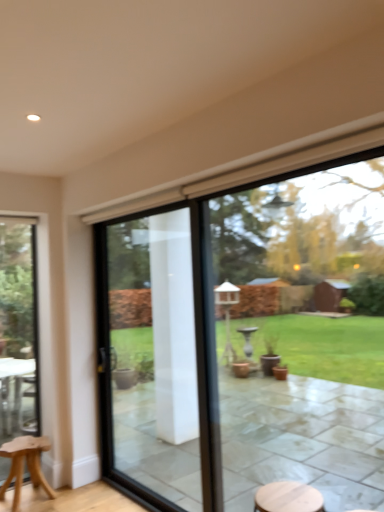
The width and height of the screenshot is (384, 512). I want to click on clear glass door at center, so click(x=160, y=359).

Considering the relative sizes of clear glass door at left, arranged as the 2th window when viewed from the front, and clear glass door at center in the image provided, is clear glass door at left, arranged as the 2th window when viewed from the front, shorter than clear glass door at center?

No.

In terms of width, does clear glass door at left, acting as the first window starting from the back, look wider or thinner when compared to clear glass door at center?

Considering their sizes, clear glass door at left, acting as the first window starting from the back, looks slimmer than clear glass door at center.

Between clear glass door at left, arranged as the 2th window when viewed from the front, and clear glass door at center, which one appears on the left side from the viewer's perspective?

From the viewer's perspective, clear glass door at left, arranged as the 2th window when viewed from the front, appears more on the left side.

Is clear glass door at left, the second window when ordered from right to left, directly adjacent to clear glass door at center?

No, clear glass door at left, the second window when ordered from right to left, is not in contact with clear glass door at center.

Can you confirm if clear glass door at center is taller than light brown wooden stool at lower left?

Indeed, clear glass door at center has a greater height compared to light brown wooden stool at lower left.

Between clear glass door at center and light brown wooden stool at lower left, which one appears on the left side from the viewer's perspective?

From the viewer's perspective, light brown wooden stool at lower left appears more on the left side.

Is clear glass door at center far away from light brown wooden stool at lower left?

That's right, there is a large distance between clear glass door at center and light brown wooden stool at lower left.

What's the angular difference between clear glass door at center and light brown wooden stool at lower left's facing directions?

There is a 0.547-degree angle between the facing directions of clear glass door at center and light brown wooden stool at lower left.

Is light brown wooden stool at lower left wider or thinner than clear glass door at left, acting as the first window starting from the back?

light brown wooden stool at lower left is wider than clear glass door at left, acting as the first window starting from the back.

Considering their positions, is light brown wooden stool at lower left located in front of or behind clear glass door at left, the second window when ordered from right to left?

Visually, light brown wooden stool at lower left is located in front of clear glass door at left, the second window when ordered from right to left.

Could you tell me if light brown wooden stool at lower left is facing clear glass door at left, acting as the first window starting from the back?

No, light brown wooden stool at lower left is not aimed at clear glass door at left, acting as the first window starting from the back.

Which object is more forward, transparent glass window at center, the 2th window in the left-to-right sequence, or clear glass door at center?

Answer: transparent glass window at center, the 2th window in the left-to-right sequence.

From the image's perspective, which is below, transparent glass window at center, the 2th window in the left-to-right sequence, or clear glass door at center?

clear glass door at center appears lower in the image.

Which is behind, point (150, 480) or point (138, 222)?

The point (138, 222) is behind.

How distant is transparent glass window at center, the second window from the back, from clear glass door at center?

transparent glass window at center, the second window from the back, is 4.61 feet away from clear glass door at center.

From a real-world perspective, is light brown wooden stool at lower left positioned under clear glass door at center based on gravity?

Indeed, from a real-world perspective, light brown wooden stool at lower left is positioned beneath clear glass door at center.

Is light brown wooden stool at lower left in contact with clear glass door at center?

No, light brown wooden stool at lower left is not in contact with clear glass door at center.

Considering the positions of objects light brown wooden stool at lower left and clear glass door at center in the image provided, who is behind, light brown wooden stool at lower left or clear glass door at center?

Positioned behind is light brown wooden stool at lower left.

Relative to transparent glass window at center, the 2th window in the left-to-right sequence, is clear glass door at left, acting as the first window starting from the back, in front or behind?

Clearly, clear glass door at left, acting as the first window starting from the back, is behind transparent glass window at center, the 2th window in the left-to-right sequence.

Is transparent glass window at center, the first window when ordered from right to left, at the back of clear glass door at left, the second window when ordered from right to left?

No, clear glass door at left, the second window when ordered from right to left, is not facing the opposite direction of transparent glass window at center, the first window when ordered from right to left.

Between clear glass door at left, the 1th window when ordered from left to right, and transparent glass window at center, the second window from the back, which one has larger width?

transparent glass window at center, the second window from the back.

Is light brown wooden stool at lower left facing towards transparent glass window at center, the 2th window in the left-to-right sequence?

No, light brown wooden stool at lower left is not facing towards transparent glass window at center, the 2th window in the left-to-right sequence.

Considering the sizes of light brown wooden stool at lower left and transparent glass window at center, the first window when ordered from right to left, in the image, is light brown wooden stool at lower left taller or shorter than transparent glass window at center, the first window when ordered from right to left,?

light brown wooden stool at lower left is shorter than transparent glass window at center, the first window when ordered from right to left.

From a real-world perspective, which is physically above, light brown wooden stool at lower left or transparent glass window at center, the 2th window in the left-to-right sequence?

In real-world perspective, transparent glass window at center, the 2th window in the left-to-right sequence, is above.

Locate an element on the screen. This screenshot has width=384, height=512. window behind the clear glass door at center is located at coordinates click(x=18, y=329).

This screenshot has height=512, width=384. I want to click on screen door above the light brown wooden stool at lower left (from a real-world perspective), so click(x=160, y=359).

When comparing their distances from transparent glass window at center, the second window from the back, does clear glass door at center or light brown wooden stool at lower left seem closer?

clear glass door at center lies closer to transparent glass window at center, the second window from the back, than the other object.

Estimate the real-world distances between objects in this image. Which object is closer to light brown wooden stool at lower left, clear glass door at left, arranged as the 2th window when viewed from the front, or transparent glass window at center, the 2th window in the left-to-right sequence?

clear glass door at left, arranged as the 2th window when viewed from the front.

Looking at the image, which one is located closer to transparent glass window at center, the second window from the back, light brown wooden stool at lower left or clear glass door at left, arranged as the 2th window when viewed from the front?

clear glass door at left, arranged as the 2th window when viewed from the front.

Based on their spatial positions, is clear glass door at left, the 1th window when ordered from left to right, or transparent glass window at center, the 2th window in the left-to-right sequence, further from clear glass door at center?

transparent glass window at center, the 2th window in the left-to-right sequence, lies further to clear glass door at center than the other object.

Looking at the image, which one is located further to clear glass door at center, transparent glass window at center, placed as the first window when sorted from front to back, or clear glass door at left, the second window when ordered from right to left?

transparent glass window at center, placed as the first window when sorted from front to back, is positioned further to the anchor clear glass door at center.

Based on their spatial positions, is clear glass door at left, acting as the first window starting from the back, or clear glass door at center closer to transparent glass window at center, the second window from the back?

The object closer to transparent glass window at center, the second window from the back, is clear glass door at center.

Estimate the real-world distances between objects in this image. Which object is further from clear glass door at left, the second window when ordered from right to left, transparent glass window at center, the second window from the back, or light brown wooden stool at lower left?

Among the two, transparent glass window at center, the second window from the back, is located further to clear glass door at left, the second window when ordered from right to left.

Looking at the image, which one is located closer to transparent glass window at center, placed as the first window when sorted from front to back, clear glass door at left, arranged as the 2th window when viewed from the front, or light brown wooden stool at lower left?

clear glass door at left, arranged as the 2th window when viewed from the front, is positioned closer to the anchor transparent glass window at center, placed as the first window when sorted from front to back.

This screenshot has height=512, width=384. I want to click on stool between clear glass door at left, the 1th window when ordered from left to right, and clear glass door at center from left to right, so click(x=23, y=464).

In order to click on screen door between clear glass door at left, the second window when ordered from right to left, and transparent glass window at center, the second window from the back in this screenshot , I will do `click(160, 359)`.

The image size is (384, 512). I want to click on screen door between light brown wooden stool at lower left and transparent glass window at center, the first window when ordered from right to left, in the horizontal direction, so 160,359.

You are a GUI agent. You are given a task and a screenshot of the screen. Output one action in this format:
    pyautogui.click(x=<x>, y=<y>)
    Task: Click on the stool located between clear glass door at left, the second window when ordered from right to left, and transparent glass window at center, the 2th window in the left-to-right sequence, in the left-right direction
    Image resolution: width=384 pixels, height=512 pixels.
    Given the screenshot: What is the action you would take?
    click(23, 464)